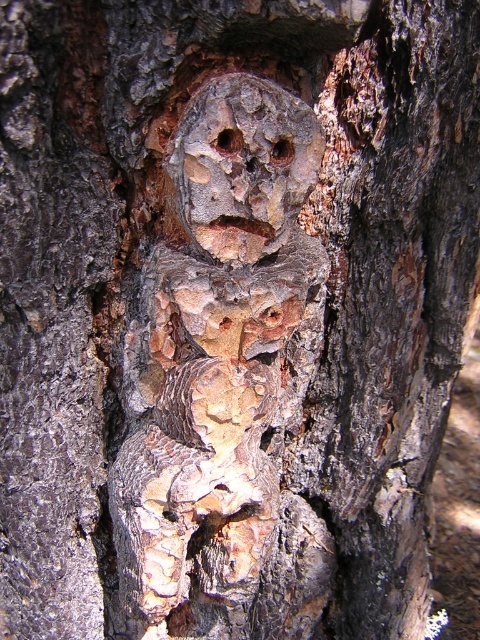
You are an artist planning to paint a portrait of the rustic bark face at upper center and the smooth wood hole at center. Which object should you paint first if you want to follow the size hierarchy from largest to smallest?

The rustic bark face at upper center should be painted first because it is taller than the smooth wood hole at center, making it the larger object in the scene.

You are standing 20 inches away from the tree trunk. You want to touch the brown rough bark hole at center. Can you reach it without moving closer?

The brown rough bark hole at center is 18.11 inches away from the viewer. Since you are standing 20 inches away, you are 1.89 inches too far to reach it without moving closer.